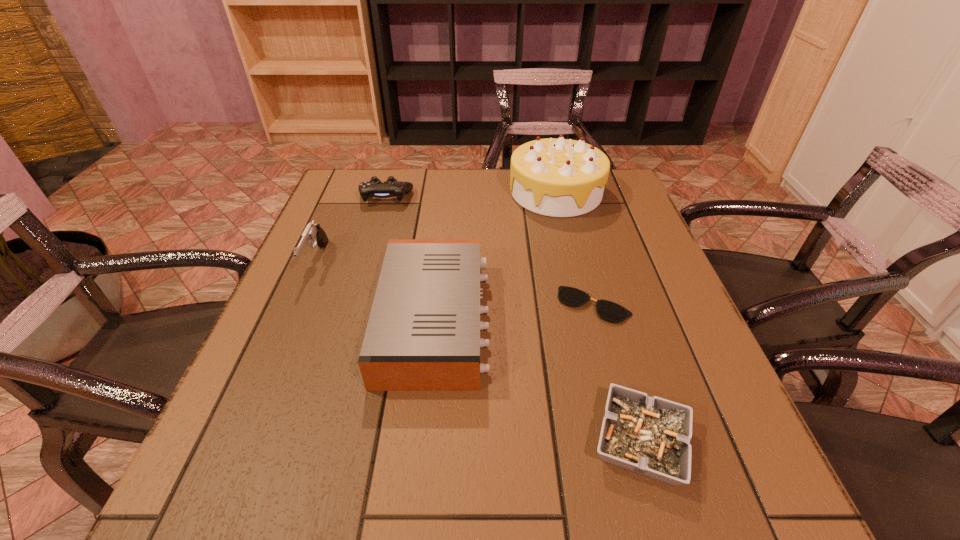
At what (x,y) coordinates should I click in order to perform the action: click on vacant area that lies between the birthday cake and the fourth tallest object. Please return your answer as a coordinate pair (x, y). Looking at the image, I should click on (470, 195).

Find the location of a particular element. The width and height of the screenshot is (960, 540). free space between the shortest object and the control is located at coordinates (490, 251).

Where is `free space between the gun and the fourth tallest object`? The width and height of the screenshot is (960, 540). free space between the gun and the fourth tallest object is located at coordinates (351, 230).

The height and width of the screenshot is (540, 960). What are the coordinates of `free spot between the gun and the radio receiver` in the screenshot? It's located at (375, 291).

At what (x,y) coordinates should I click in order to perform the action: click on empty location between the spectacles and the tallest object. Please return your answer as a coordinate pair (x, y). The width and height of the screenshot is (960, 540). Looking at the image, I should click on (575, 248).

Where is `vacant region between the ashtray and the third shortest object`? vacant region between the ashtray and the third shortest object is located at coordinates (514, 320).

Locate which object ranks in proximity to the fourth tallest object. Please provide its 2D coordinates. Your answer should be formatted as a tuple, i.e. [(x, y)], where the tuple contains the x and y coordinates of a point satisfying the conditions above.

[(313, 233)]

Image resolution: width=960 pixels, height=540 pixels. In order to click on object that is the third closest to the third tallest object in this screenshot , I will do `click(313, 233)`.

The width and height of the screenshot is (960, 540). What are the coordinates of `free space that satisfies the following two spatial constraints: 1. at the muzzle of the gun; 2. on the right side of the ashtray` in the screenshot? It's located at (239, 442).

Image resolution: width=960 pixels, height=540 pixels. Find the location of `free space in the image that satisfies the following two spatial constraints: 1. on the front side of the tallest object; 2. on the left side of the spectacles`. free space in the image that satisfies the following two spatial constraints: 1. on the front side of the tallest object; 2. on the left side of the spectacles is located at coordinates (584, 305).